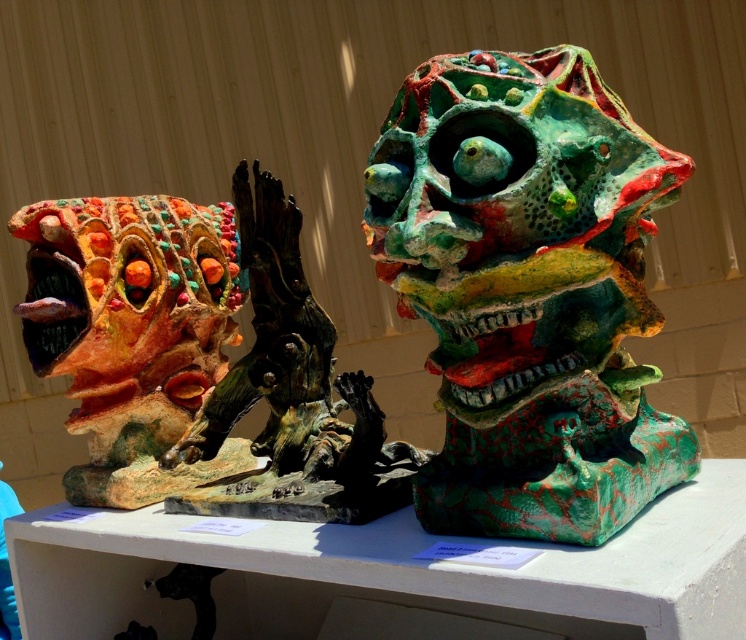
Question: Which point is closer to the camera?

Choices:
 (A) matte ceramic dragon at left
 (B) textured clay sculpture at left

Answer: (B)

Question: Is textured green sculpture at center to the right of matte ceramic dragon at left from the viewer's perspective?

Choices:
 (A) yes
 (B) no

Answer: (A)

Question: Does matte ceramic dragon at left appear over textured clay sculpture at left?

Choices:
 (A) no
 (B) yes

Answer: (B)

Question: Can you confirm if textured green sculpture at center is smaller than textured clay sculpture at left?

Choices:
 (A) yes
 (B) no

Answer: (A)

Question: Estimate the real-world distances between objects in this image. Which object is farther from the textured clay sculpture at left?

Choices:
 (A) textured green sculpture at center
 (B) matte ceramic dragon at left

Answer: (A)

Question: Which of the following is the farthest from the observer?

Choices:
 (A) (448, 122)
 (B) (250, 285)

Answer: (B)